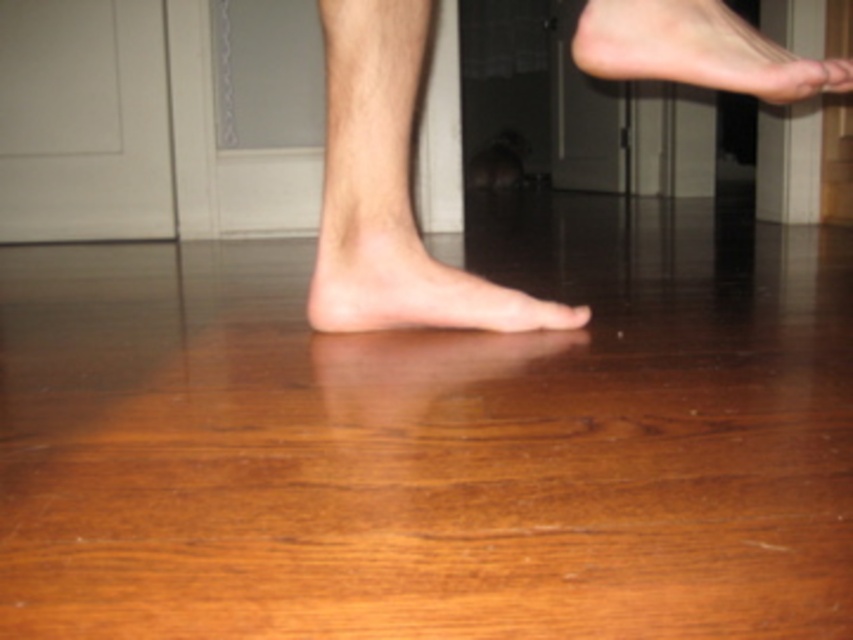
Is hairless skin at center further to the viewer compared to skinny barefoot at upper right?

Yes.

Is point (405, 179) behind point (599, 42)?

Yes, point (405, 179) is farther from viewer.

The height and width of the screenshot is (640, 853). What are the coordinates of `hairless skin at center` in the screenshot? It's located at (386, 188).

Locate an element on the screen. Image resolution: width=853 pixels, height=640 pixels. hairless skin at center is located at coordinates point(386,188).

What do you see at coordinates (416, 292) in the screenshot? This screenshot has width=853, height=640. I see `skinny barefoot at center` at bounding box center [416, 292].

Describe the element at coordinates (416, 292) in the screenshot. I see `skinny barefoot at center` at that location.

Identify the location of skinny barefoot at center. (416, 292).

Is hairless skin at center wider than matte wood toe at center?

Indeed, hairless skin at center has a greater width compared to matte wood toe at center.

Is hairless skin at center above matte wood toe at center?

Correct, hairless skin at center is located above matte wood toe at center.

Is point (363, 200) in front of point (566, 307)?

Yes, it is.

Image resolution: width=853 pixels, height=640 pixels. I want to click on hairless skin at center, so click(386, 188).